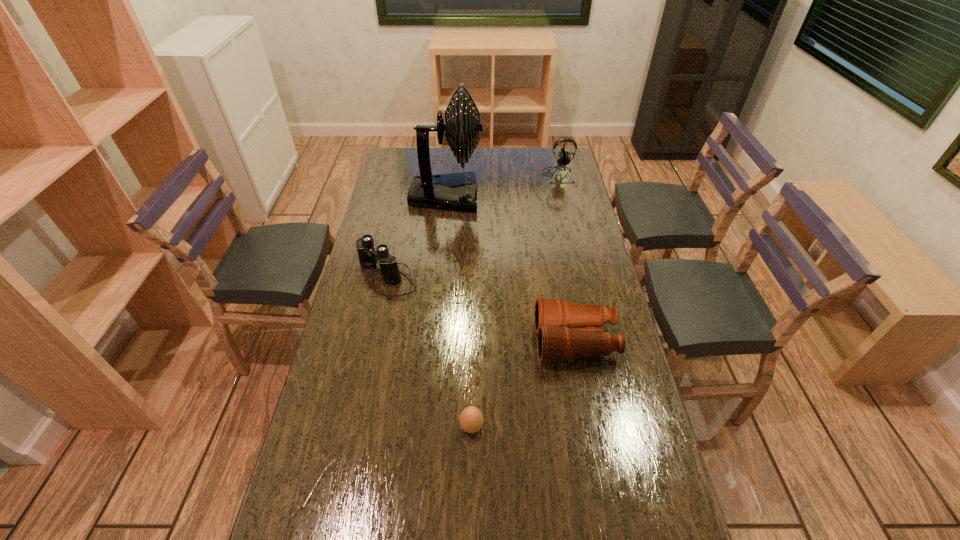
Image resolution: width=960 pixels, height=540 pixels. I want to click on free space located on the front of the farther binoculars, so click(x=375, y=333).

Identify the location of vacant point located through the lenses of the right binoculars. This screenshot has height=540, width=960. click(x=485, y=341).

Find the location of a particular element. The width and height of the screenshot is (960, 540). free space located through the lenses of the right binoculars is located at coordinates (414, 341).

Identify the location of free region located 0.330m through the lenses of the right binoculars. The image size is (960, 540). (430, 341).

At what (x,y) coordinates should I click in order to perform the action: click on vacant space located on the front of the boiled egg. Please return your answer as a coordinate pair (x, y). This screenshot has height=540, width=960. Looking at the image, I should click on click(470, 538).

The width and height of the screenshot is (960, 540). Identify the location of object present at the far edge. (563, 157).

Find the location of a particular element. fan positioned at the left edge is located at coordinates (457, 191).

Image resolution: width=960 pixels, height=540 pixels. Identify the location of binoculars that is at the left edge. coord(368,256).

This screenshot has height=540, width=960. I want to click on earphone positioned at the right edge, so click(x=563, y=157).

Where is `binoculars present at the right edge`? binoculars present at the right edge is located at coordinates (560, 325).